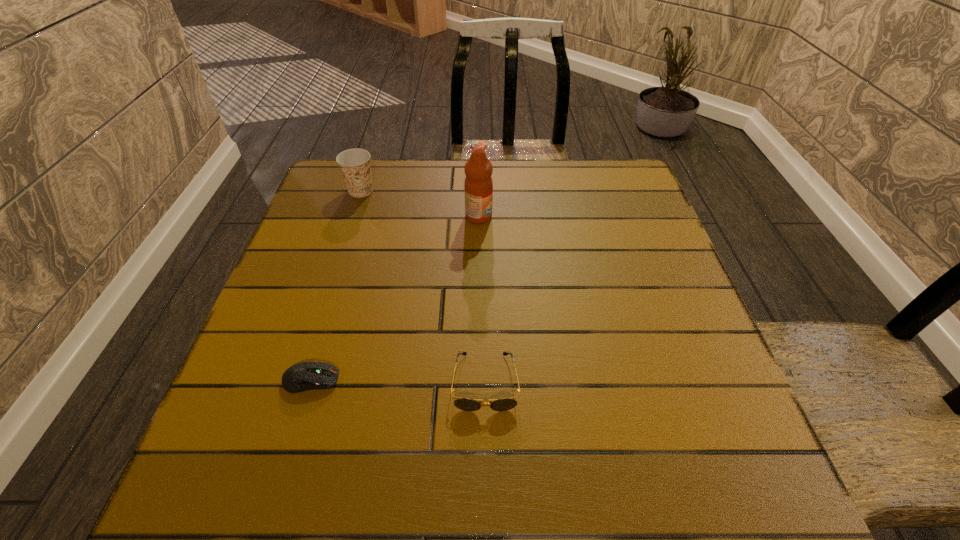
Where is `the tallest object`? the tallest object is located at coordinates (478, 185).

Locate an element on the screen. The width and height of the screenshot is (960, 540). the second farthest object is located at coordinates (478, 185).

The width and height of the screenshot is (960, 540). I want to click on Dixie cup, so click(x=355, y=166).

Where is `the farthest object`? The height and width of the screenshot is (540, 960). the farthest object is located at coordinates (355, 166).

This screenshot has width=960, height=540. In order to click on sunglasses in this screenshot , I will do `click(466, 404)`.

I want to click on the shortest object, so click(303, 376).

The image size is (960, 540). Find the location of `free spot located on the front label of the fruit juice`. free spot located on the front label of the fruit juice is located at coordinates (540, 217).

Locate an element on the screen. vacant space situated on the front of the farthest object is located at coordinates (352, 217).

In order to click on vacant space located on the lenses of the second shortest object in this screenshot , I will do `click(486, 448)`.

Locate an element on the screen. vacant region located 0.110m on the button of the computer equipment is located at coordinates (399, 380).